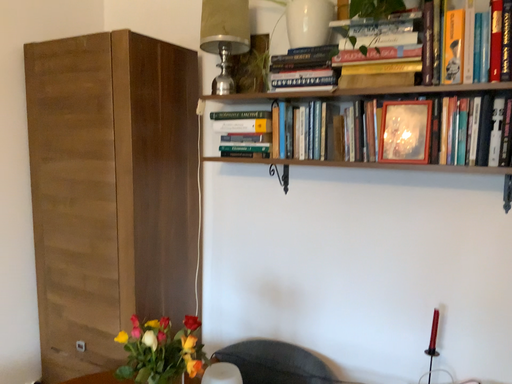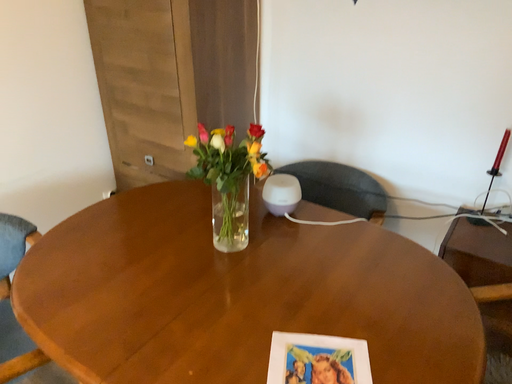
Question: Which way did the camera rotate in the video?

Choices:
 (A) rotated left
 (B) rotated right

Answer: (A)